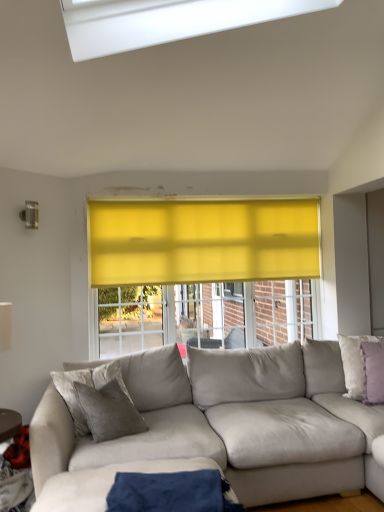
Question: Considering the relative sizes of purple velvet pillow at right, which ranks as the 2th pillow in front-to-back order, and blue fabric at lower center in the image provided, is purple velvet pillow at right, which ranks as the 2th pillow in front-to-back order, wider than blue fabric at lower center?

Choices:
 (A) yes
 (B) no

Answer: (B)

Question: Considering the relative sizes of purple velvet pillow at right, which ranks as the 2th pillow in front-to-back order, and blue fabric at lower center in the image provided, is purple velvet pillow at right, which ranks as the 2th pillow in front-to-back order, shorter than blue fabric at lower center?

Choices:
 (A) no
 (B) yes

Answer: (A)

Question: Is purple velvet pillow at right, the 1th pillow positioned from the back, oriented away from blue fabric at lower center?

Choices:
 (A) no
 (B) yes

Answer: (A)

Question: Considering the relative sizes of purple velvet pillow at right, which ranks as the 2th pillow in front-to-back order, and blue fabric at lower center in the image provided, is purple velvet pillow at right, which ranks as the 2th pillow in front-to-back order, thinner than blue fabric at lower center?

Choices:
 (A) no
 (B) yes

Answer: (B)

Question: From a real-world perspective, is purple velvet pillow at right, the 1th pillow positioned from the back, on top of blue fabric at lower center?

Choices:
 (A) no
 (B) yes

Answer: (B)

Question: Is the position of purple velvet pillow at right, which ranks as the 2th pillow in front-to-back order, more distant than that of blue fabric at lower center?

Choices:
 (A) no
 (B) yes

Answer: (B)

Question: From a real-world perspective, is purple velvet pillow at right, which is counted as the 2th pillow, starting from the back, positioned over suede beige couch at lower right based on gravity?

Choices:
 (A) yes
 (B) no

Answer: (A)

Question: Is there a large distance between purple velvet pillow at right, the 1th pillow viewed from the front, and suede beige couch at lower right?

Choices:
 (A) yes
 (B) no

Answer: (B)

Question: Does purple velvet pillow at right, which is counted as the 2th pillow, starting from the back, appear on the right side of suede beige couch at lower right?

Choices:
 (A) no
 (B) yes

Answer: (B)

Question: Could you tell me if purple velvet pillow at right, which is counted as the 2th pillow, starting from the back, is turned towards suede beige couch at lower right?

Choices:
 (A) no
 (B) yes

Answer: (B)

Question: Is the depth of purple velvet pillow at right, which is counted as the 2th pillow, starting from the back, less than that of suede beige couch at lower right?

Choices:
 (A) no
 (B) yes

Answer: (A)

Question: From the image's perspective, is purple velvet pillow at right, which is counted as the 2th pillow, starting from the back, beneath suede beige couch at lower right?

Choices:
 (A) yes
 (B) no

Answer: (B)

Question: Is suede beige couch at lower right in contact with white matte table lamp at left?

Choices:
 (A) no
 (B) yes

Answer: (A)